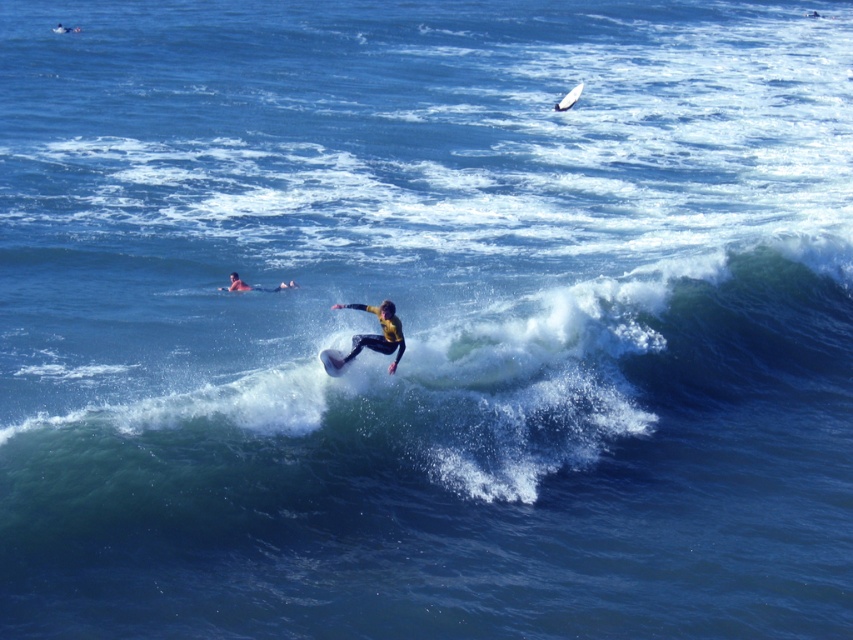
You are a photographer on a boat observing the scene. You need to capture a photo where both the smooth skin person at upper left and the white foam surfboard at upper right are visible. Based on their heights, which one will appear closer to the top edge of the photo?

The white foam surfboard at upper right appears higher in the frame since it has a greater height than the smooth skin person at upper left, so it will be closer to the top edge of the photo.